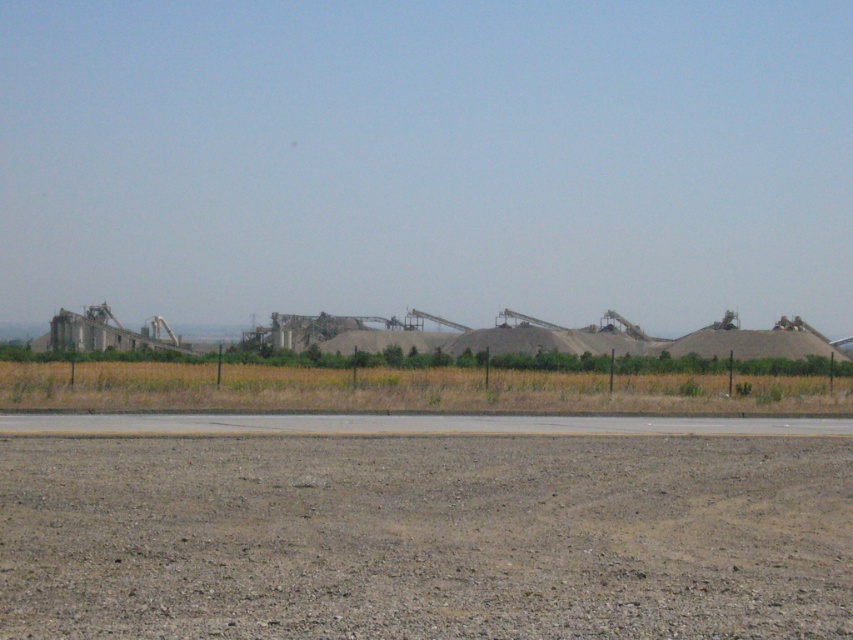
Question: Which of the following is the closest to the observer?

Choices:
 (A) (154, 413)
 (B) (804, 532)

Answer: (B)

Question: Does brown gravelly dirt at lower center appear over gray asphalt runway at center?

Choices:
 (A) no
 (B) yes

Answer: (B)

Question: Is brown gravelly dirt at lower center positioned behind gray asphalt runway at center?

Choices:
 (A) yes
 (B) no

Answer: (B)

Question: Which point is farther to the camera?

Choices:
 (A) (589, 422)
 (B) (718, 545)

Answer: (A)

Question: In this image, where is brown gravelly dirt at lower center located relative to gray asphalt runway at center?

Choices:
 (A) above
 (B) below

Answer: (A)

Question: Which point is closer to the camera?

Choices:
 (A) brown gravelly dirt at lower center
 (B) gray asphalt runway at center

Answer: (A)